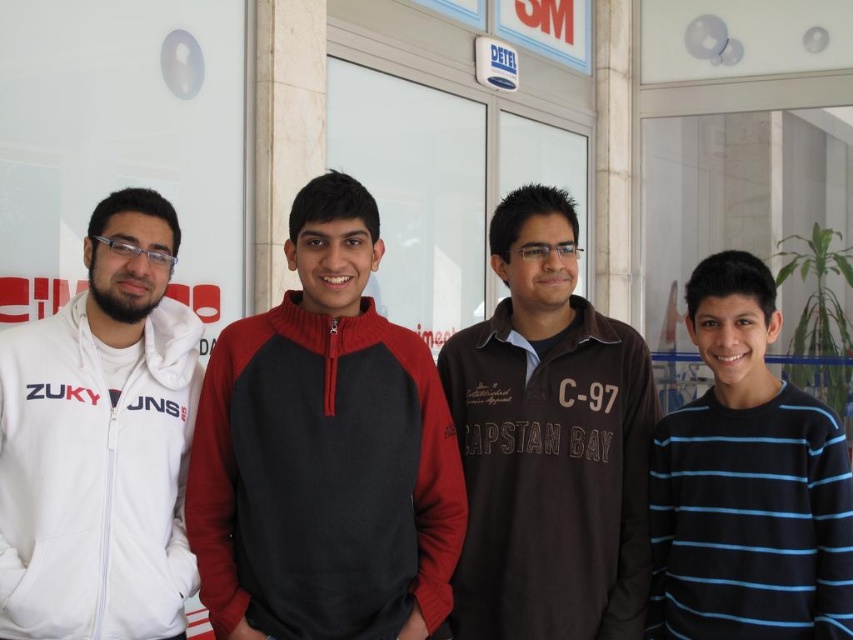
Question: Where is white fleece jacket at left located in relation to blue striped sweater at right in the image?

Choices:
 (A) below
 (B) above

Answer: (B)

Question: Which point is closer to the camera?

Choices:
 (A) click(107, 540)
 (B) click(689, 509)

Answer: (A)

Question: Is white fleece jacket at left to the left of brown cotton shirt at center from the viewer's perspective?

Choices:
 (A) yes
 (B) no

Answer: (A)

Question: Which object is the farthest from the dark gray fleece sweatshirt at center?

Choices:
 (A) brown cotton shirt at center
 (B) blue striped sweater at right

Answer: (B)

Question: Is white fleece jacket at left positioned in front of blue striped sweater at right?

Choices:
 (A) no
 (B) yes

Answer: (B)

Question: Estimate the real-world distances between objects in this image. Which object is closer to the brown cotton shirt at center?

Choices:
 (A) white fleece jacket at left
 (B) blue striped sweater at right

Answer: (B)